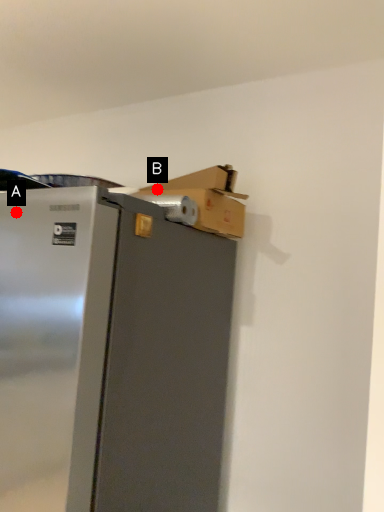
Question: Two points are circled on the image, labeled by A and B beside each circle. Which point appears closest to the camera in this image?

Choices:
 (A) A is closer
 (B) B is closer

Answer: (A)